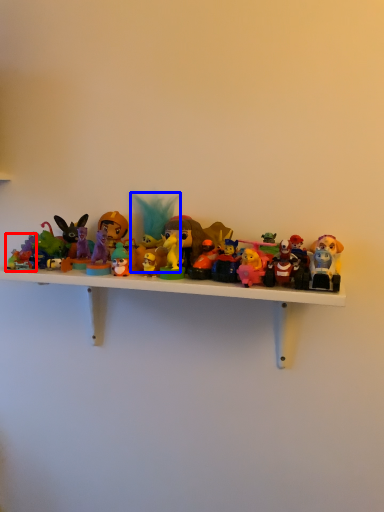
Question: Which object appears closest to the camera in this image, toy (highlighted by a red box) or toy (highlighted by a blue box)?

Choices:
 (A) toy
 (B) toy

Answer: (A)